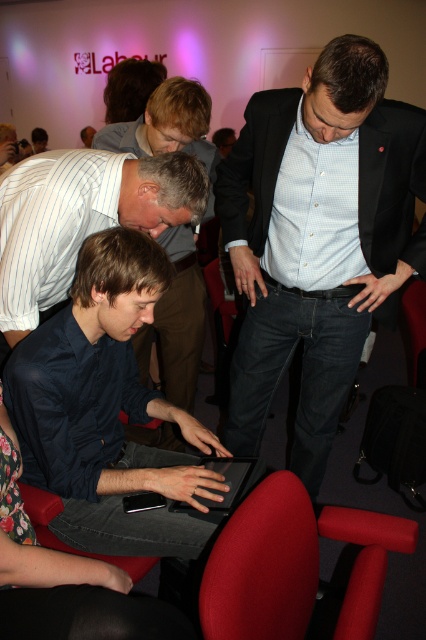
Is matte black suit at center in front of dark blue shirt at center?

Yes, matte black suit at center is closer to the viewer.

Describe the element at coordinates (317, 237) in the screenshot. Image resolution: width=426 pixels, height=640 pixels. I see `matte black suit at center` at that location.

Describe the element at coordinates (317, 237) in the screenshot. The height and width of the screenshot is (640, 426). I see `matte black suit at center` at that location.

What are the coordinates of `matte black suit at center` in the screenshot? It's located at (317, 237).

Is the position of velvet red chair at lower center more distant than that of dark blue shirt at center?

No, velvet red chair at lower center is in front of dark blue shirt at center.

Who is lower down, velvet red chair at lower center or dark blue shirt at center?

velvet red chair at lower center is below.

I want to click on velvet red chair at lower center, so click(x=293, y=564).

Between matte black suit at center and black matte tablet at center, which one appears on the left side from the viewer's perspective?

black matte tablet at center

Can you confirm if matte black suit at center is smaller than black matte tablet at center?

Incorrect, matte black suit at center is not smaller in size than black matte tablet at center.

Is point (374, 257) positioned behind point (242, 461)?

Yes, it is.

Locate an element on the screen. Image resolution: width=426 pixels, height=640 pixels. matte black suit at center is located at coordinates (317, 237).